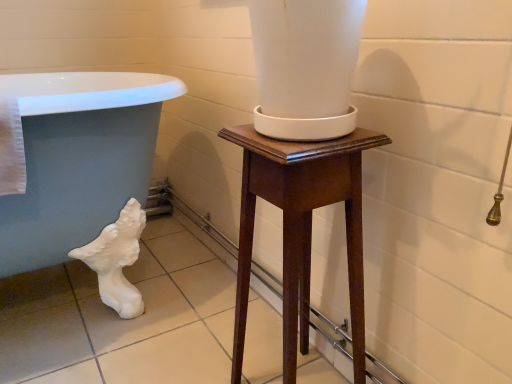
What do you see at coordinates (78, 159) in the screenshot? Image resolution: width=512 pixels, height=384 pixels. I see `white glossy bath at lower left` at bounding box center [78, 159].

I want to click on white glossy bath at lower left, so click(x=78, y=159).

Locate an element on the screen. This screenshot has height=384, width=512. mahogany wood pedestal at center is located at coordinates (301, 228).

What do you see at coordinates (301, 228) in the screenshot?
I see `mahogany wood pedestal at center` at bounding box center [301, 228].

This screenshot has width=512, height=384. I want to click on white glossy bath at lower left, so 78,159.

Does mahogany wood pedestal at center appear on the right side of white glossy bath at lower left?

Yes.

Does mahogany wood pedestal at center lie behind white glossy bath at lower left?

No, mahogany wood pedestal at center is in front of white glossy bath at lower left.

Which point is more forward, (x=304, y=336) or (x=63, y=98)?

Point (x=63, y=98)

From the image's perspective, which object appears higher, mahogany wood pedestal at center or white glossy bath at lower left?

From the image's view, white glossy bath at lower left is above.

From a real-world perspective, which is physically below, mahogany wood pedestal at center or white glossy bath at lower left?

mahogany wood pedestal at center.

Is mahogany wood pedestal at center thinner than white glossy bath at lower left?

Indeed, mahogany wood pedestal at center has a lesser width compared to white glossy bath at lower left.

In terms of height, does mahogany wood pedestal at center look taller or shorter compared to white glossy bath at lower left?

mahogany wood pedestal at center is shorter than white glossy bath at lower left.

In the scene shown: Does mahogany wood pedestal at center have a smaller size compared to white glossy bath at lower left?

Yes.

Does mahogany wood pedestal at center contain white glossy bath at lower left?

Actually, white glossy bath at lower left is outside mahogany wood pedestal at center.

Is mahogany wood pedestal at center not near white glossy bath at lower left?

No.

Could you tell me if mahogany wood pedestal at center is facing white glossy bath at lower left?

No, mahogany wood pedestal at center is not facing towards white glossy bath at lower left.

This screenshot has height=384, width=512. I want to click on furniture lying below the white glossy bath at lower left (from the image's perspective), so click(x=301, y=228).

Based on their positions, is white glossy bath at lower left located to the left or right of mahogany wood pedestal at center?

white glossy bath at lower left is positioned on mahogany wood pedestal at center's left side.

In the image, is white glossy bath at lower left positioned in front of or behind mahogany wood pedestal at center?

white glossy bath at lower left is positioned farther from the viewer than mahogany wood pedestal at center.

Which is farther from the camera, [14,257] or [261,158]?

The point [14,257] is farther from the camera.

From the image's perspective, does white glossy bath at lower left appear higher than mahogany wood pedestal at center?

Yes, from the image's perspective, white glossy bath at lower left is on top of mahogany wood pedestal at center.

From a real-world perspective, is white glossy bath at lower left on top of mahogany wood pedestal at center?

Yes.

Considering the sizes of objects white glossy bath at lower left and mahogany wood pedestal at center in the image provided, who is wider, white glossy bath at lower left or mahogany wood pedestal at center?

Wider between the two is white glossy bath at lower left.

Does white glossy bath at lower left have a greater height compared to mahogany wood pedestal at center?

Indeed, white glossy bath at lower left has a greater height compared to mahogany wood pedestal at center.

Is white glossy bath at lower left bigger than mahogany wood pedestal at center?

Yes.

Could mahogany wood pedestal at center be considered to be inside white glossy bath at lower left?

That's incorrect, mahogany wood pedestal at center is not inside white glossy bath at lower left.

Is white glossy bath at lower left with mahogany wood pedestal at center?

No, white glossy bath at lower left is not with mahogany wood pedestal at center.

Is mahogany wood pedestal at center at the back of white glossy bath at lower left?

white glossy bath at lower left is not turned away from mahogany wood pedestal at center.

Locate an element on the screen. The width and height of the screenshot is (512, 384). bath on the left of the mahogany wood pedestal at center is located at coordinates (78, 159).

I want to click on bath behind the mahogany wood pedestal at center, so click(78, 159).

Identify the location of furniture that appears on the right of white glossy bath at lower left. This screenshot has width=512, height=384. (301, 228).